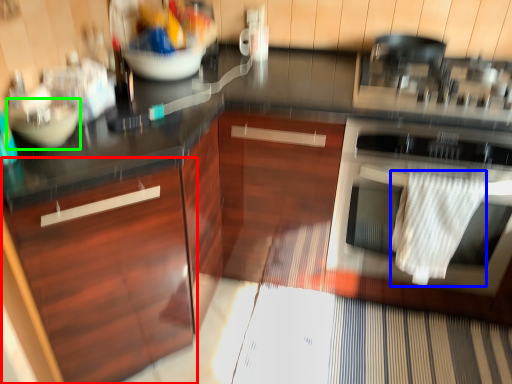
Question: Which object is the closest to the cabinetry (highlighted by a red box)? Choose among these: material (highlighted by a blue box) or mixing bowl (highlighted by a green box).

Choices:
 (A) material
 (B) mixing bowl

Answer: (B)